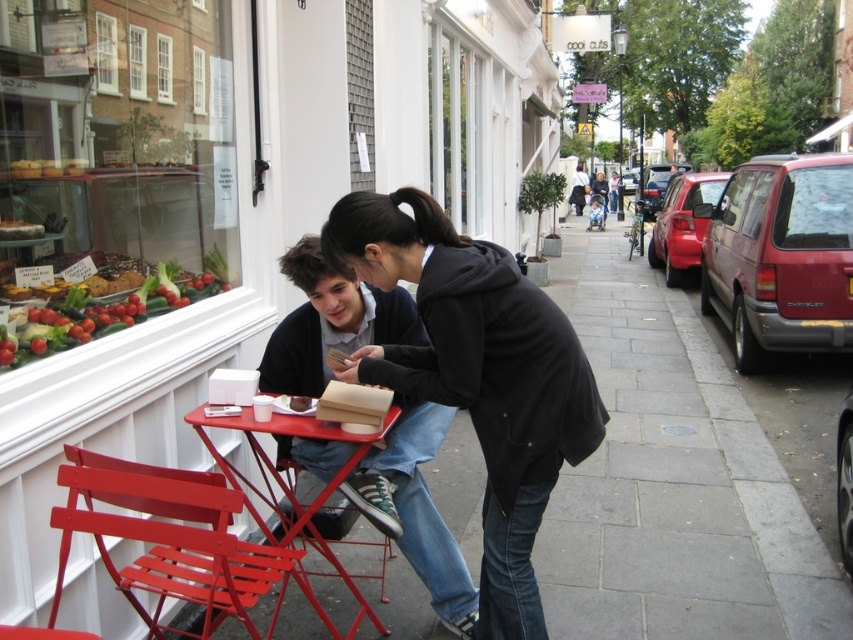
Who is positioned more to the right, black matte jacket at center or metallic red chair at lower left?

A: Positioned to the right is black matte jacket at center.

Which is below, black matte jacket at center or metallic red chair at lower left?

Positioned lower is metallic red chair at lower left.

The image size is (853, 640). Describe the element at coordinates (477, 374) in the screenshot. I see `black matte jacket at center` at that location.

The image size is (853, 640). Find the location of `black matte jacket at center`. black matte jacket at center is located at coordinates (477, 374).

Which is more to the right, matte black table at center or black matte jacket at center?

Positioned to the right is matte black table at center.

Between point (80, 193) and point (585, 372), which one is positioned in front?

Positioned in front is point (585, 372).

Where is `matte black table at center`? The image size is (853, 640). matte black table at center is located at coordinates (222, 192).

Does matte black table at center have a greater height compared to metallic red chair at lower center?

Correct, matte black table at center is much taller as metallic red chair at lower center.

Which is in front, point (53, 90) or point (318, 515)?

Point (53, 90)

Between point (187, 429) and point (334, 500), which one is positioned in front?

Point (187, 429) is more forward.

Find the location of a particular element. This screenshot has height=640, width=853. matte black table at center is located at coordinates (222, 192).